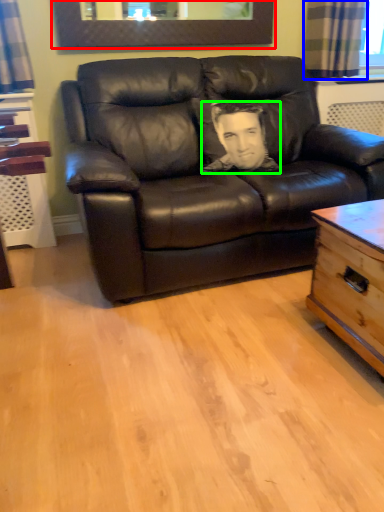
Question: Considering the real-world distances, which object is closest to picture frame (highlighted by a red box)? curtain (highlighted by a blue box) or man (highlighted by a green box).

Choices:
 (A) curtain
 (B) man

Answer: (A)